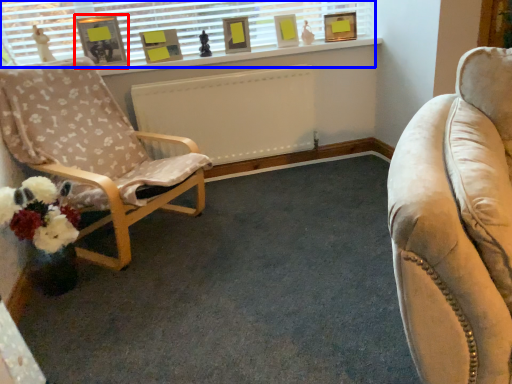
Question: Which object appears closest to the camera in this image, picture frame (highlighted by a red box) or window (highlighted by a blue box)?

Choices:
 (A) picture frame
 (B) window

Answer: (A)